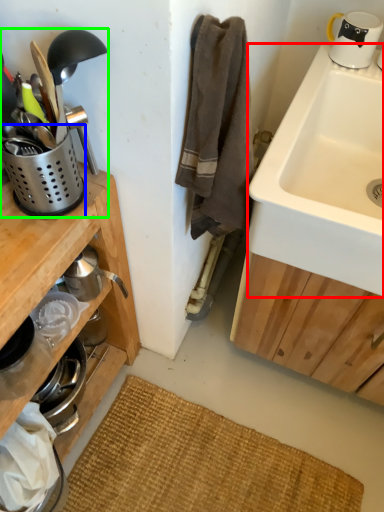
Question: Estimate the real-world distances between objects in this image. Which object is farther from sink (highlighted by a red box), appliance (highlighted by a blue box) or appliance (highlighted by a green box)?

Choices:
 (A) appliance
 (B) appliance

Answer: (A)